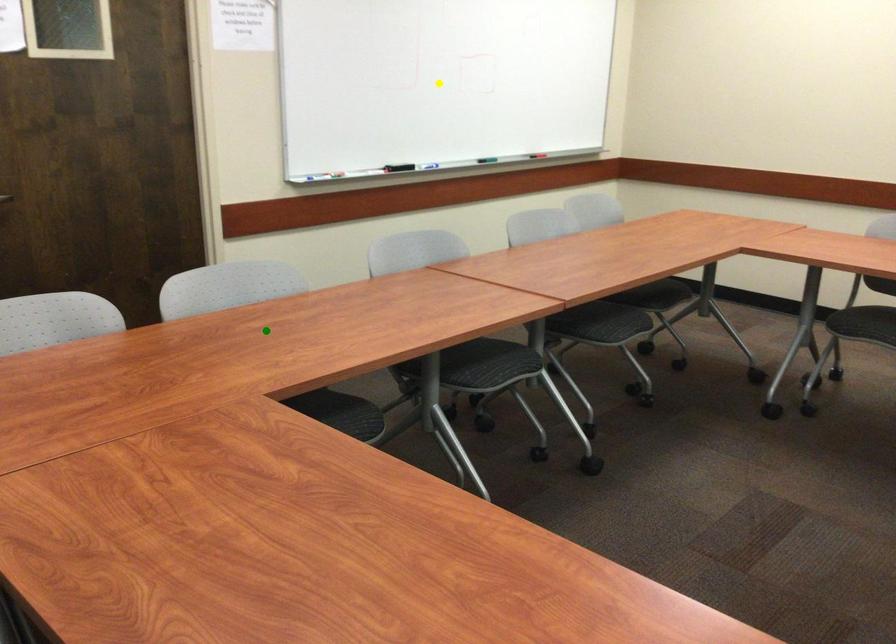
Order these from nearest to farthest:
yellow point
green point
red point

green point < red point < yellow point